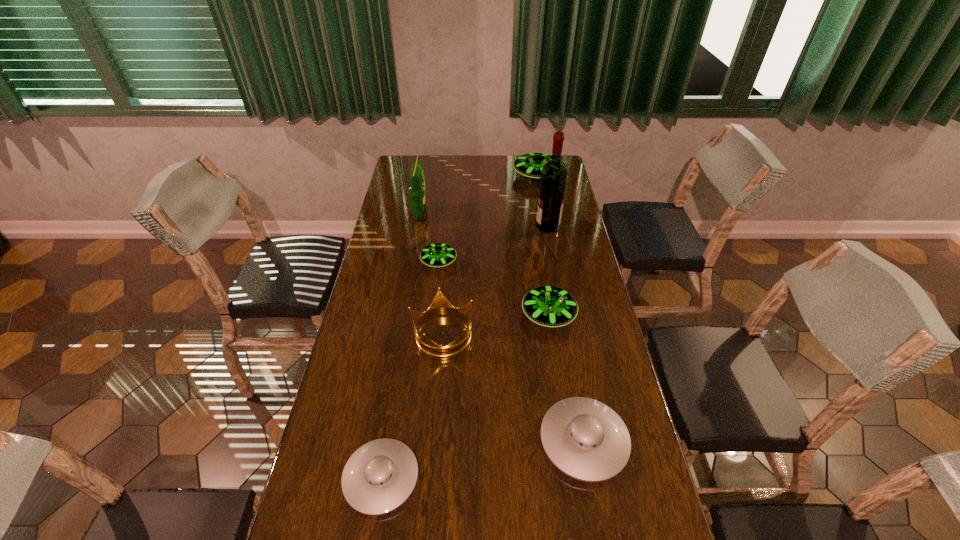
I want to click on the second nearest green saucer, so 436,255.

The width and height of the screenshot is (960, 540). Find the location of `the second farthest saucer`. the second farthest saucer is located at coordinates (436, 255).

You are a GUI agent. You are given a task and a screenshot of the screen. Output one action in this format:
    pyautogui.click(x=<x>, y=<y>)
    Task: Click on the left gray saucer
    This screenshot has width=960, height=540.
    Given the screenshot: What is the action you would take?
    pyautogui.click(x=379, y=477)

Find the location of a particular element. The height and width of the screenshot is (540, 960). free space located on the front and back of the alcohol is located at coordinates (465, 226).

Where is `vacant space located on the front and back of the alcohol`? The image size is (960, 540). vacant space located on the front and back of the alcohol is located at coordinates (511, 226).

This screenshot has width=960, height=540. I want to click on blank space located 0.340m on the front and back of the alcohol, so click(x=453, y=226).

You are a GUI agent. You are given a task and a screenshot of the screen. Output one action in this format:
    pyautogui.click(x=<x>, y=<y>)
    Task: Click on the blank space located 0.060m on the front-facing side of the seventh shortest object
    
    Given the screenshot: What is the action you would take?
    pyautogui.click(x=442, y=212)

Where is `free space located 0.320m on the left of the farthest object`? free space located 0.320m on the left of the farthest object is located at coordinates (445, 176).

The height and width of the screenshot is (540, 960). In order to click on blank space located 0.210m on the right of the gold crown in this screenshot , I will do `click(540, 334)`.

The height and width of the screenshot is (540, 960). I want to click on free point located on the front of the fifth tallest object, so click(561, 392).